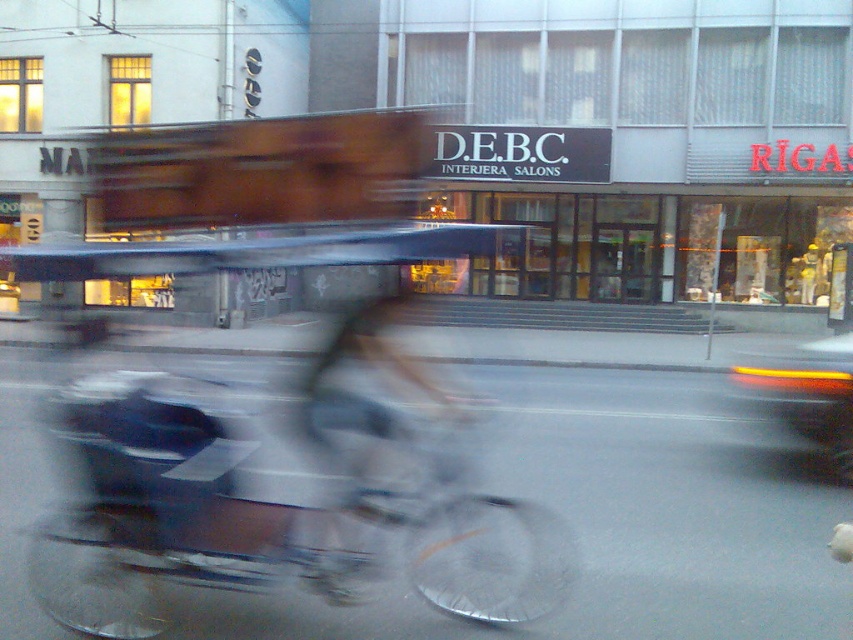
Question: Can you confirm if metallic silver bicycle at center is positioned to the left of gray fabric jacket at center?

Choices:
 (A) yes
 (B) no

Answer: (A)

Question: Which of the following is the farthest from the observer?

Choices:
 (A) (817, 445)
 (B) (421, 476)
 (C) (401, 372)

Answer: (A)

Question: Which point appears farthest from the camera in this image?

Choices:
 (A) (769, 371)
 (B) (440, 593)
 (C) (392, 417)

Answer: (A)

Question: Can you confirm if gray fabric jacket at center is bigger than matte orange tail light at right?

Choices:
 (A) no
 (B) yes

Answer: (A)

Question: Can you confirm if metallic silver bicycle at center is bigger than matte orange tail light at right?

Choices:
 (A) no
 (B) yes

Answer: (A)

Question: Estimate the real-world distances between objects in this image. Which object is closer to the gray fabric jacket at center?

Choices:
 (A) matte orange tail light at right
 (B) metallic silver bicycle at center

Answer: (B)